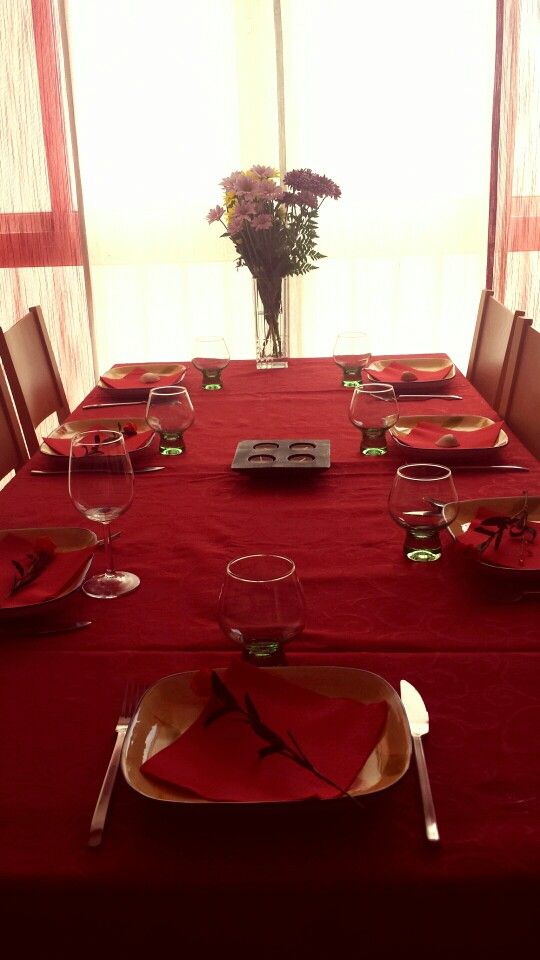
At what (x,y) coordinates should I click in order to perform the action: click on glass cups. Please return your answer as a coordinate pair (x, y). Image resolution: width=540 pixels, height=960 pixels. Looking at the image, I should click on pyautogui.click(x=262, y=605), pyautogui.click(x=111, y=488), pyautogui.click(x=172, y=414), pyautogui.click(x=215, y=353), pyautogui.click(x=348, y=348), pyautogui.click(x=376, y=401), pyautogui.click(x=425, y=497).